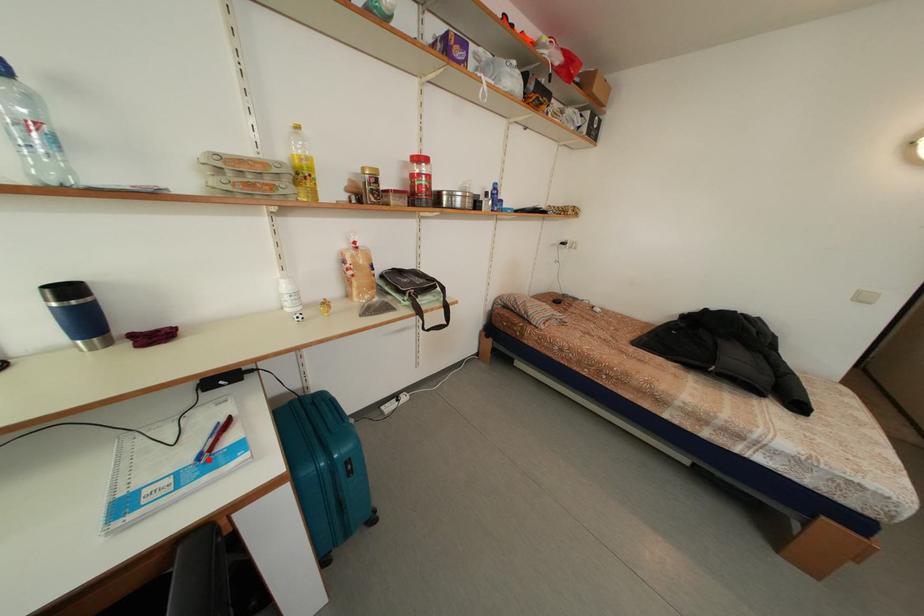
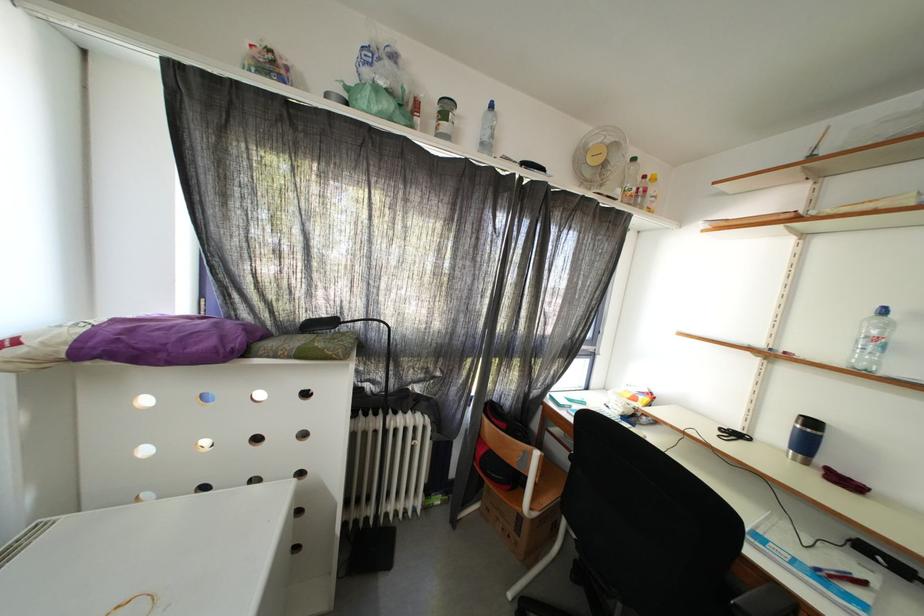
The point at the highlighted location is marked in the first image. Where is the corresponding point in the second image?

(827, 573)